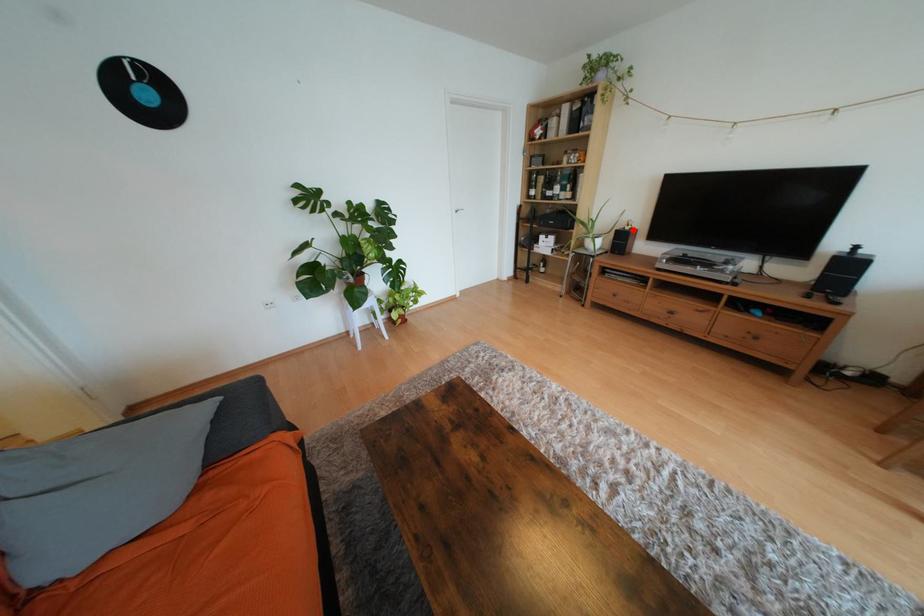
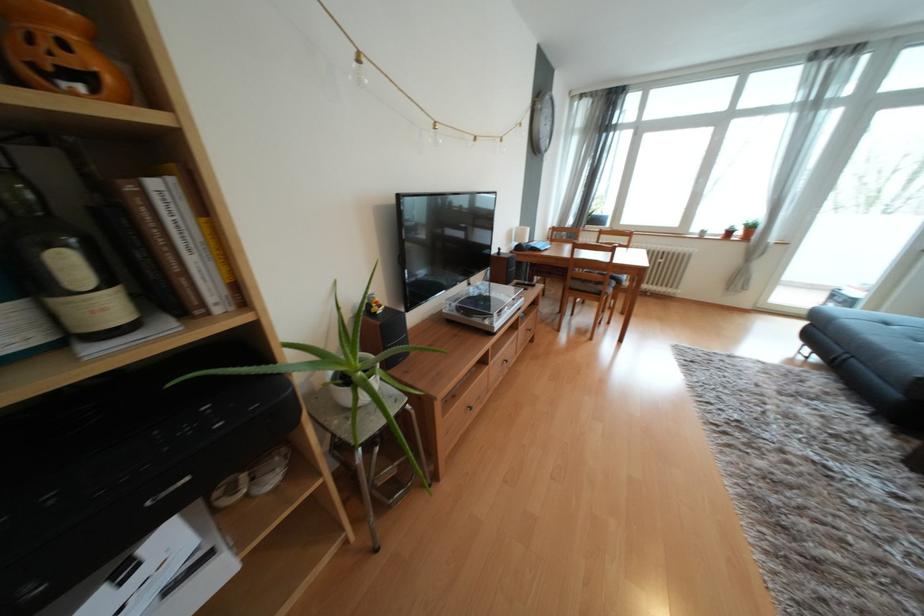
Question: I am providing you with two images of the same scene from different viewpoints. Image1 has a red point marked. In image2, the corresponding 3D location appears at what relative position? Reply with the corresponding letter.

Choices:
 (A) Closer
 (B) Farther

Answer: (B)